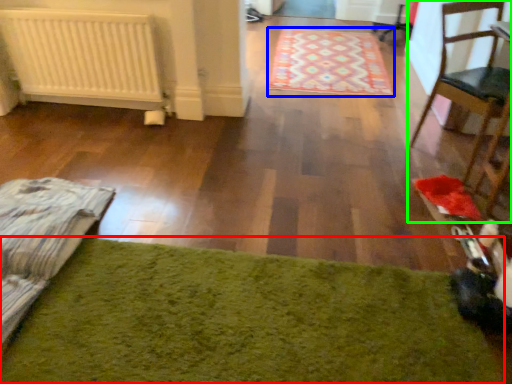
Question: Based on their relative distances, which object is nearer to mat (highlighted by a red box)? Choose from mat (highlighted by a blue box) and chair (highlighted by a green box).

Choices:
 (A) mat
 (B) chair

Answer: (B)